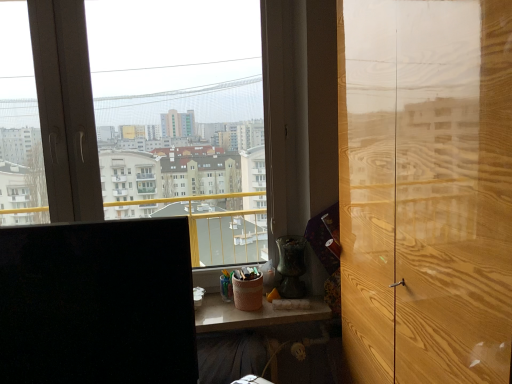
Question: Considering the relative positions of light brown wood door at right and black matte computer monitor at left in the image provided, is light brown wood door at right behind black matte computer monitor at left?

Choices:
 (A) yes
 (B) no

Answer: (B)

Question: Is black matte computer monitor at left at the back of light brown wood door at right?

Choices:
 (A) no
 (B) yes

Answer: (A)

Question: From the image's perspective, does light brown wood door at right appear higher than black matte computer monitor at left?

Choices:
 (A) yes
 (B) no

Answer: (A)

Question: Is light brown wood door at right at the left side of black matte computer monitor at left?

Choices:
 (A) yes
 (B) no

Answer: (B)

Question: Does light brown wood door at right touch black matte computer monitor at left?

Choices:
 (A) yes
 (B) no

Answer: (B)

Question: Is light brown wood door at right smaller than black matte computer monitor at left?

Choices:
 (A) yes
 (B) no

Answer: (B)

Question: Is transparent glass window at center beside black matte computer monitor at left?

Choices:
 (A) yes
 (B) no

Answer: (B)

Question: Is transparent glass window at center not within black matte computer monitor at left?

Choices:
 (A) no
 (B) yes

Answer: (B)

Question: Can you confirm if transparent glass window at center is wider than black matte computer monitor at left?

Choices:
 (A) yes
 (B) no

Answer: (B)

Question: Does transparent glass window at center appear on the left side of black matte computer monitor at left?

Choices:
 (A) no
 (B) yes

Answer: (A)

Question: Is transparent glass window at center further to camera compared to black matte computer monitor at left?

Choices:
 (A) yes
 (B) no

Answer: (A)

Question: From the image's perspective, is transparent glass window at center over black matte computer monitor at left?

Choices:
 (A) yes
 (B) no

Answer: (A)

Question: Is black matte computer monitor at left positioned far away from transparent glass window at center?

Choices:
 (A) no
 (B) yes

Answer: (A)